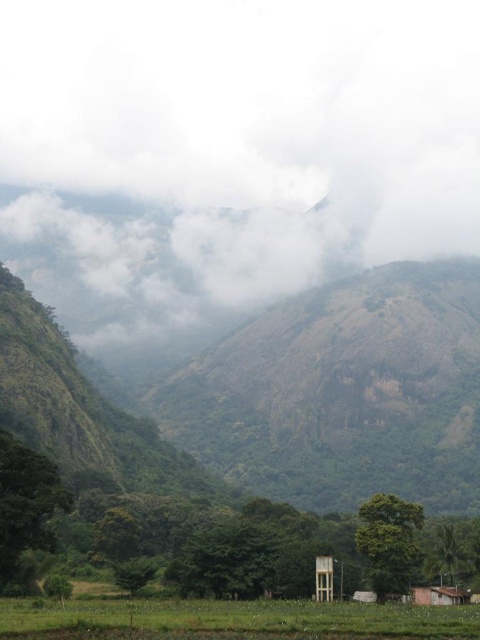
You are a farmer planning to plant crops in the green grassy rice field at lower center and the brown wooden hut at lower right. Which area has a larger width for planting more crops?

The green grassy rice field at lower center has a larger width than the brown wooden hut at lower right, so it can accommodate more crops.

You are a drone operator flying over a mountainous region. Your mission is to capture aerial footage of the white fluffy cloud at upper center and the green grassy rice field at lower center. Based on their positions, which object should you adjust your camera angle upwards to focus on?

The white fluffy cloud at upper center is located above the green grassy rice field at lower center, so you should adjust your camera angle upwards to focus on the white fluffy cloud at upper center.

You are a drone operator flying a drone with a camera. You want to capture a photo of the white fluffy cloud at upper center and the green grassy rice field at lower center in the same frame. Which object should you focus on first to ensure both are in the frame?

The white fluffy cloud at upper center might be wider than the green grassy rice field at lower center, so you should focus on the white fluffy cloud at upper center first to ensure both are captured in the frame.